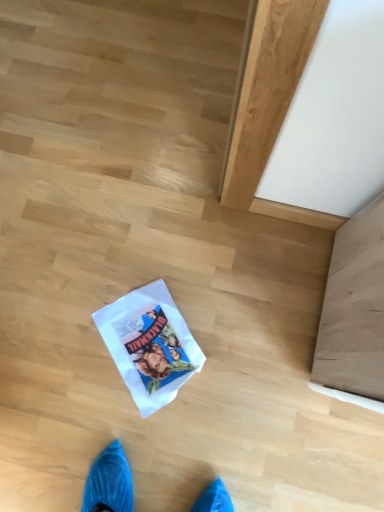
The image size is (384, 512). I want to click on vacant point to the right of white paper comic book at center, so click(x=243, y=338).